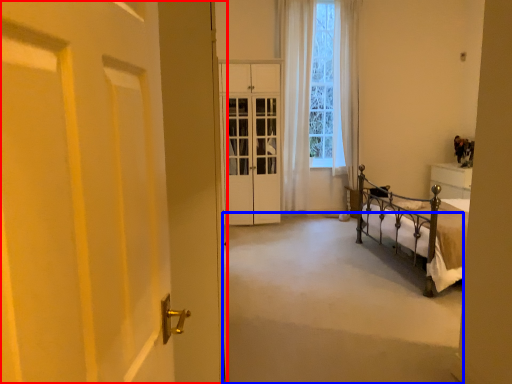
Question: Which point is further to the camera, door (highlighted by a red box) or corridor (highlighted by a blue box)?

Choices:
 (A) door
 (B) corridor

Answer: (B)